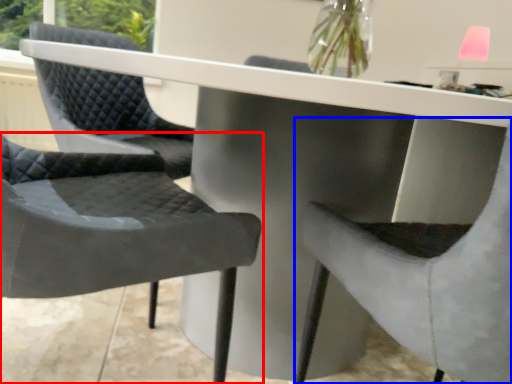
Question: Among these objects, which one is farthest to the camera, chair (highlighted by a red box) or chair (highlighted by a blue box)?

Choices:
 (A) chair
 (B) chair

Answer: (A)